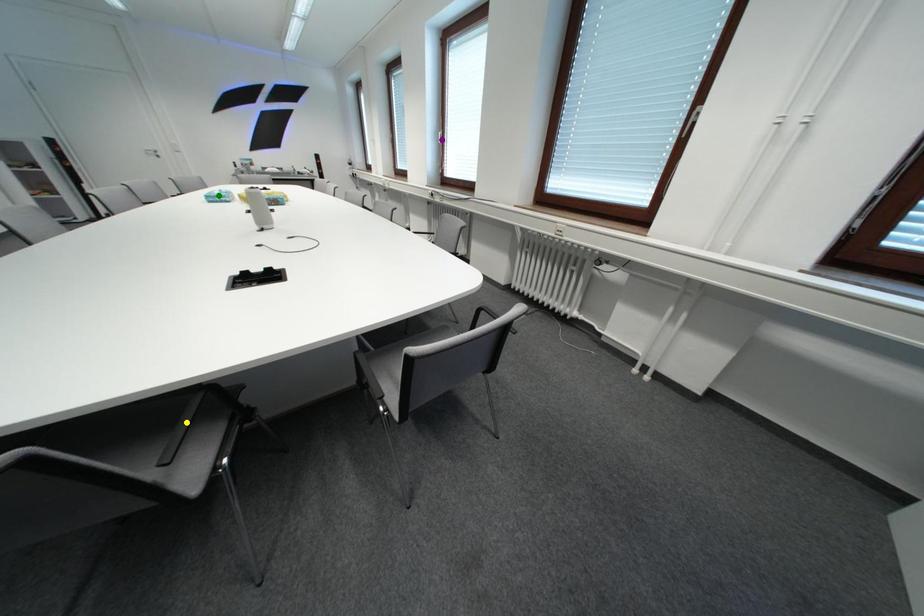
Order these from nearest to farthest:
green point
yellow point
purple point

yellow point → green point → purple point